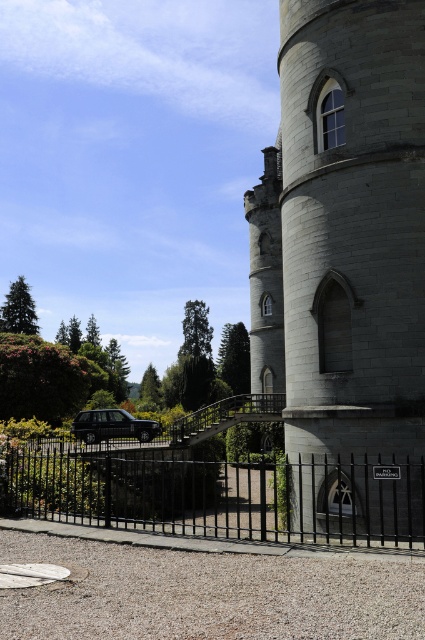
You are a tour guide explaining the historic site to visitors. You mention the gray stone tower at center and the black wrought iron fence at lower center. Which one is taller?

The gray stone tower at center is taller than the black wrought iron fence at lower center.

You are a tour guide explaining the structure of the historic site. Which object, the gray stone tower at center or the black wrought iron fence at lower center, has a narrower width?

The gray stone tower at center is thinner than the black wrought iron fence at lower center, so the gray stone tower at center has a narrower width.

You are standing on the gravel pathway leading to the gray stone tower at center and the black wrought iron fence at lower center. Which object is closer to you as you approach the tower?

The black wrought iron fence at lower center is closer to you because it is positioned in front of the gray stone tower at center, which is further away.